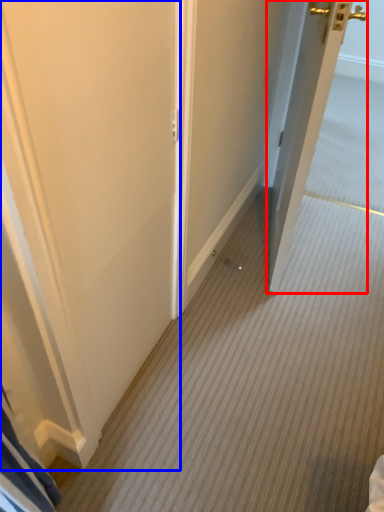
Question: Which point is further to the camera, door (highlighted by a red box) or door (highlighted by a blue box)?

Choices:
 (A) door
 (B) door

Answer: (A)